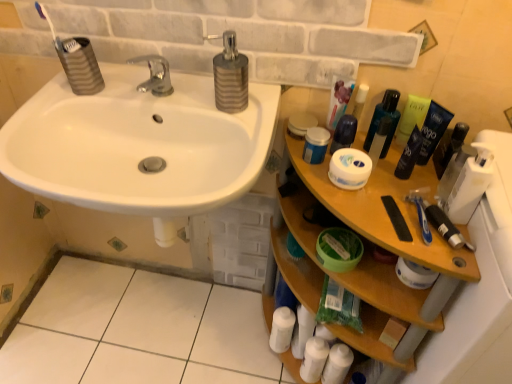
Locate an element on the screen. vacant area to the left of white matte lotion at lower center, the 2th toiletry when ordered from back to front is located at coordinates (257, 360).